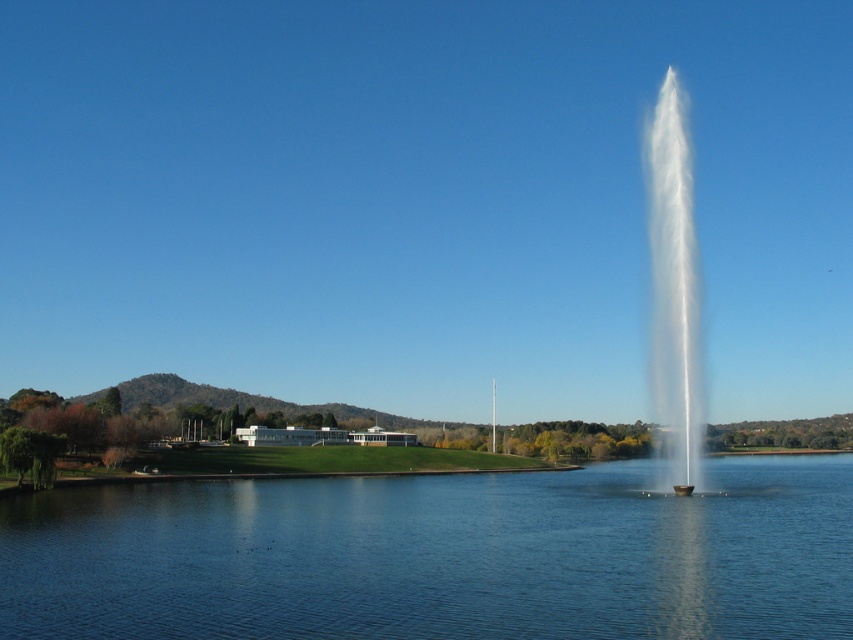
You are standing at the point with coordinates point at point [439,556]. What is the immediate surface you are standing on?

The point at [439,556] is on clear blue water at center, so the immediate surface you are standing on is clear blue water at center.

Based on the coordinates provided, where is the clear blue water at center located in the image?

The clear blue water at center is located at point 2D coordinates of (439, 556).